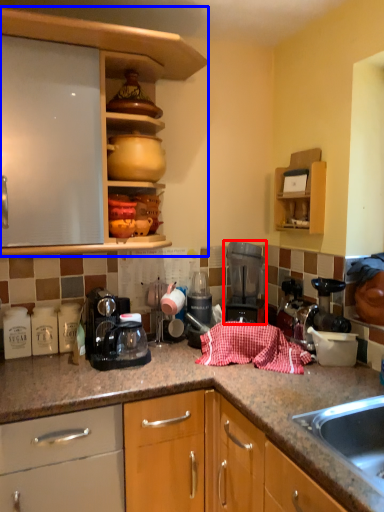
Question: Which point is further to the camera, kitchen appliance (highlighted by a red box) or cabinetry (highlighted by a blue box)?

Choices:
 (A) kitchen appliance
 (B) cabinetry

Answer: (A)